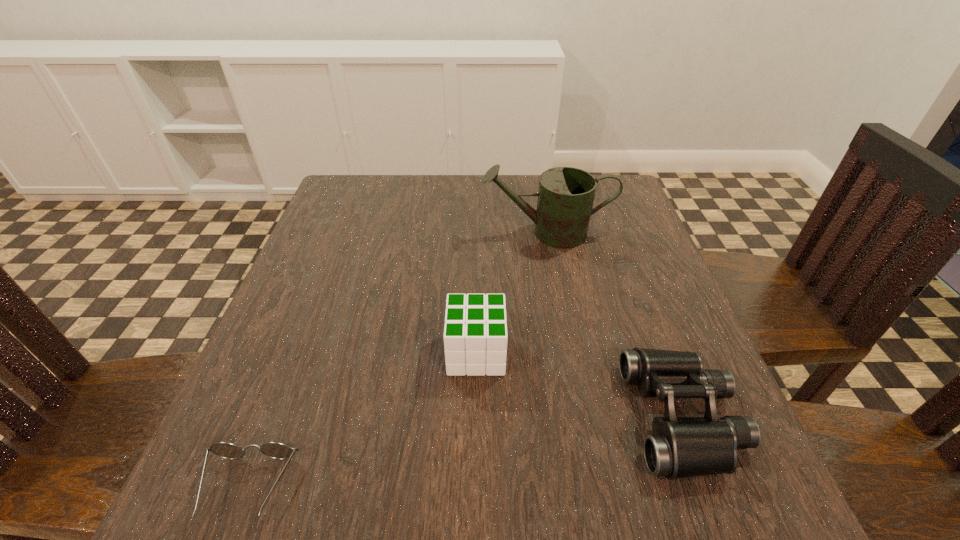
Image resolution: width=960 pixels, height=540 pixels. Find the location of `unoccupied position between the spectacles and the binoculars`. unoccupied position between the spectacles and the binoculars is located at coordinates click(x=465, y=452).

Where is `vacant point located between the third shortest object and the farthest object`? The height and width of the screenshot is (540, 960). vacant point located between the third shortest object and the farthest object is located at coordinates (511, 293).

The width and height of the screenshot is (960, 540). What are the coordinates of `unoccupied position between the third shortest object and the binoculars` in the screenshot? It's located at (579, 385).

Find the location of a particular element. The image size is (960, 540). vacant point located between the spectacles and the cube is located at coordinates (362, 420).

Find the location of a particular element. The image size is (960, 540). empty space between the third shortest object and the leftmost object is located at coordinates pos(362,420).

At what (x,y) coordinates should I click in order to perform the action: click on free space between the cube and the leftmost object. Please return your answer as a coordinate pair (x, y). The image size is (960, 540). Looking at the image, I should click on (362, 420).

Where is `blank region between the binoculars and the shortest object`? Image resolution: width=960 pixels, height=540 pixels. blank region between the binoculars and the shortest object is located at coordinates (465, 452).

Identify the location of vacant region between the spectacles and the second shortest object. (465, 452).

The height and width of the screenshot is (540, 960). In order to click on vacant space in between the leftmost object and the binoculars in this screenshot , I will do `click(465, 452)`.

Locate which object is the closest to the spectacles. Please provide its 2D coordinates. Your answer should be formatted as a tuple, i.e. [(x, y)], where the tuple contains the x and y coordinates of a point satisfying the conditions above.

[(475, 337)]